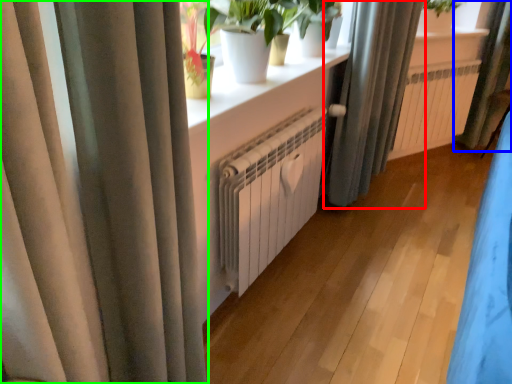
Question: Based on their relative distances, which object is farther from curtain (highlighted by a red box)? Choose from curtain (highlighted by a blue box) and curtain (highlighted by a green box).

Choices:
 (A) curtain
 (B) curtain

Answer: (B)